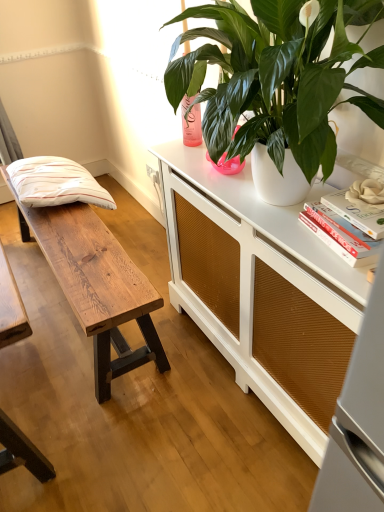
Question: Considering the relative sizes of white matte book at upper right, the first book positioned from the top, and wooden bench at left in the image provided, is white matte book at upper right, the first book positioned from the top, shorter than wooden bench at left?

Choices:
 (A) no
 (B) yes

Answer: (B)

Question: Does white matte book at upper right, the 2th book positioned from the bottom, appear on the left side of wooden bench at left?

Choices:
 (A) yes
 (B) no

Answer: (B)

Question: Is white matte book at upper right, the first book positioned from the top, taller than wooden bench at left?

Choices:
 (A) no
 (B) yes

Answer: (A)

Question: Is white matte book at upper right, the first book positioned from the top, to the right of wooden bench at left from the viewer's perspective?

Choices:
 (A) no
 (B) yes

Answer: (B)

Question: Is white matte book at upper right, the first book positioned from the top, not inside wooden bench at left?

Choices:
 (A) yes
 (B) no

Answer: (A)

Question: Does white matte book at upper right, the first book positioned from the top, have a smaller size compared to wooden bench at left?

Choices:
 (A) no
 (B) yes

Answer: (B)

Question: Is white striped pillow at left completely or partially inside white matte book at upper right, the 1th book ordered from the bottom?

Choices:
 (A) yes
 (B) no

Answer: (B)

Question: From the image's perspective, is white matte book at upper right, the 2th book from the top, located beneath white striped pillow at left?

Choices:
 (A) yes
 (B) no

Answer: (A)

Question: Is white matte book at upper right, the 1th book ordered from the bottom, at the right side of white striped pillow at left?

Choices:
 (A) yes
 (B) no

Answer: (A)

Question: Does white matte book at upper right, the 2th book from the top, appear on the left side of white striped pillow at left?

Choices:
 (A) no
 (B) yes

Answer: (A)

Question: Is white matte book at upper right, the 1th book ordered from the bottom, smaller than white striped pillow at left?

Choices:
 (A) no
 (B) yes

Answer: (B)

Question: From a real-world perspective, is white matte book at upper right, the 1th book ordered from the bottom, physically below white striped pillow at left?

Choices:
 (A) yes
 (B) no

Answer: (B)

Question: Is white matte flower at upper right thinner than white striped pillow at left?

Choices:
 (A) no
 (B) yes

Answer: (B)